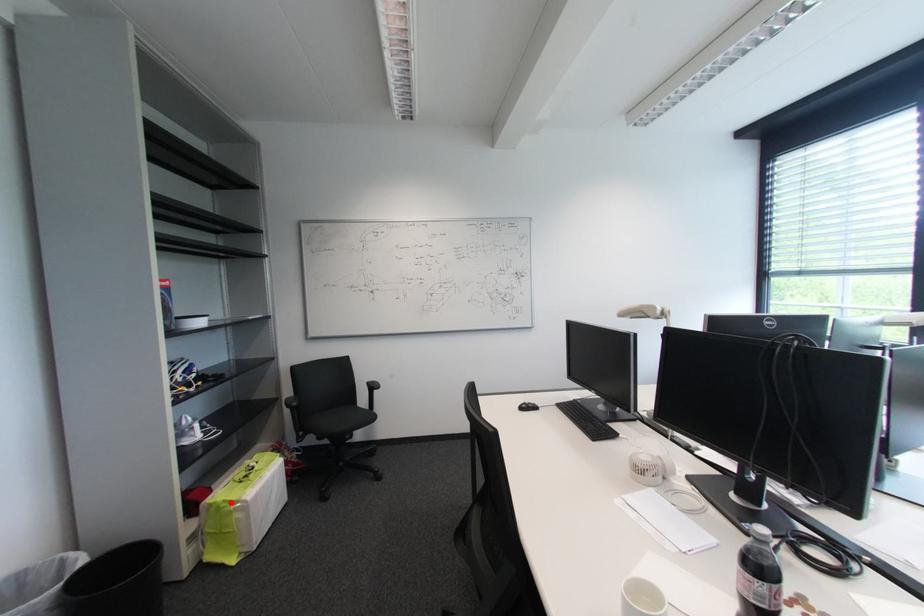
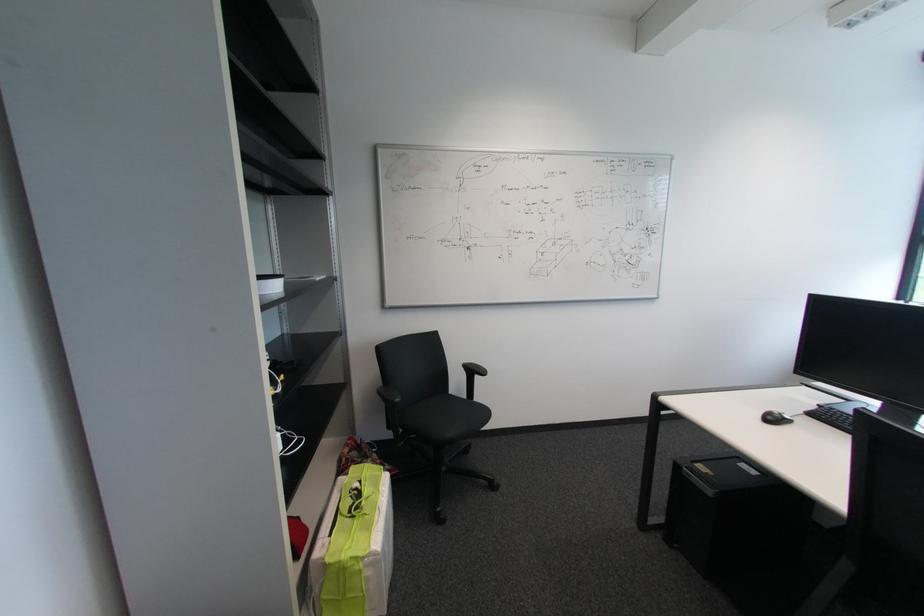
In the second image, find the point that corresponds to the highlighted location in the first image.

(358, 560)